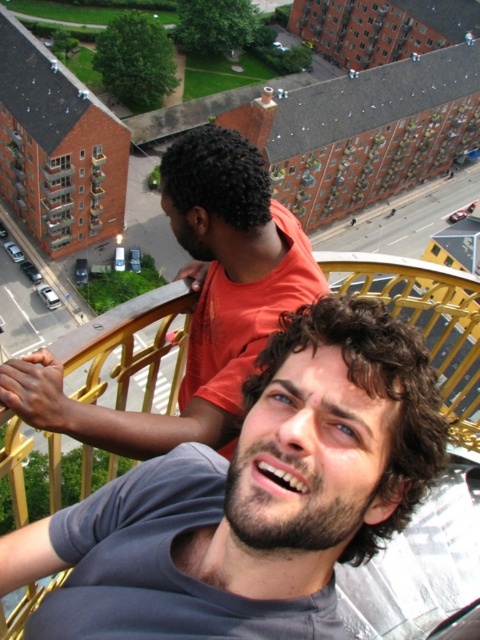
Question: Is gray cotton shirt at center closer to camera compared to gray fabric shirt at center?

Choices:
 (A) no
 (B) yes

Answer: (B)

Question: Can you confirm if gray cotton shirt at center is positioned above gray fabric shirt at center?

Choices:
 (A) yes
 (B) no

Answer: (B)

Question: Among these points, which one is farthest from the camera?

Choices:
 (A) (263, 289)
 (B) (360, 500)

Answer: (A)

Question: Does gray cotton shirt at center come behind gray fabric shirt at center?

Choices:
 (A) yes
 (B) no

Answer: (B)